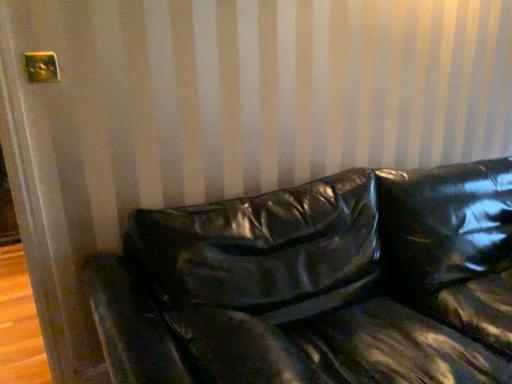
Question: Is glossy black couch at center far from metallic gold outlet at upper left?

Choices:
 (A) no
 (B) yes

Answer: (B)

Question: Can you confirm if glossy black couch at center is shorter than metallic gold outlet at upper left?

Choices:
 (A) no
 (B) yes

Answer: (A)

Question: Does glossy black couch at center lie in front of metallic gold outlet at upper left?

Choices:
 (A) yes
 (B) no

Answer: (A)

Question: Does glossy black couch at center have a lesser width compared to metallic gold outlet at upper left?

Choices:
 (A) yes
 (B) no

Answer: (B)

Question: Considering the relative sizes of glossy black couch at center and metallic gold outlet at upper left in the image provided, is glossy black couch at center taller than metallic gold outlet at upper left?

Choices:
 (A) yes
 (B) no

Answer: (A)

Question: From the image's perspective, is glossy black couch at center located beneath metallic gold outlet at upper left?

Choices:
 (A) no
 (B) yes

Answer: (B)

Question: From the image's perspective, would you say metallic gold outlet at upper left is positioned over glossy black couch at center?

Choices:
 (A) no
 (B) yes

Answer: (B)

Question: Is metallic gold outlet at upper left to the right of glossy black couch at center from the viewer's perspective?

Choices:
 (A) yes
 (B) no

Answer: (B)

Question: Considering the relative positions of metallic gold outlet at upper left and glossy black couch at center in the image provided, is metallic gold outlet at upper left behind glossy black couch at center?

Choices:
 (A) yes
 (B) no

Answer: (A)

Question: Considering the relative sizes of metallic gold outlet at upper left and glossy black couch at center in the image provided, is metallic gold outlet at upper left shorter than glossy black couch at center?

Choices:
 (A) yes
 (B) no

Answer: (A)

Question: From a real-world perspective, is metallic gold outlet at upper left below glossy black couch at center?

Choices:
 (A) no
 (B) yes

Answer: (A)

Question: Is metallic gold outlet at upper left facing towards glossy black couch at center?

Choices:
 (A) yes
 (B) no

Answer: (B)

Question: Considering the relative positions of glossy black couch at center and metallic gold outlet at upper left in the image provided, is glossy black couch at center to the left or to the right of metallic gold outlet at upper left?

Choices:
 (A) left
 (B) right

Answer: (B)